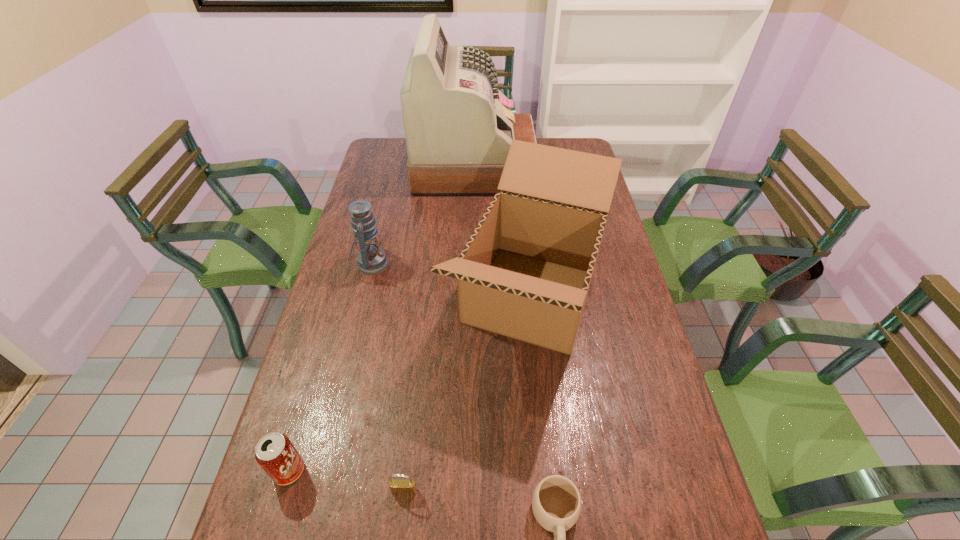
Image resolution: width=960 pixels, height=540 pixels. Find the location of `the farthest object`. the farthest object is located at coordinates (459, 126).

Find the location of a particular element. Image resolution: width=960 pixels, height=540 pixels. the tallest object is located at coordinates (459, 126).

Locate an element on the screen. box is located at coordinates (525, 272).

You are a GUI agent. You are given a task and a screenshot of the screen. Output one action in this format:
    pyautogui.click(x=<x>, y=<y>)
    Task: Click on the fourth shortest object
    
    Given the screenshot: What is the action you would take?
    pyautogui.click(x=372, y=260)

Find the location of a particular element. The image size is (960, 540). the third shortest object is located at coordinates (275, 453).

Find the location of a particular element. padlock is located at coordinates (407, 486).

The width and height of the screenshot is (960, 540). What are the coordinates of `blank space located on the operating side of the farthest object` in the screenshot? It's located at (558, 167).

You are a GUI agent. You are given a task and a screenshot of the screen. Output one action in this format:
    pyautogui.click(x=<x>, y=<y>)
    Task: Click on the vacant area located on the front of the second tallest object
    This screenshot has width=960, height=540.
    Given the screenshot: What is the action you would take?
    pyautogui.click(x=551, y=505)

Where is `free space located on the front-facing side of the fourth shortest object`? Image resolution: width=960 pixels, height=540 pixels. free space located on the front-facing side of the fourth shortest object is located at coordinates (422, 264).

Find the location of a particular element. The image size is (960, 540). vacant space located on the right of the third shortest object is located at coordinates (398, 470).